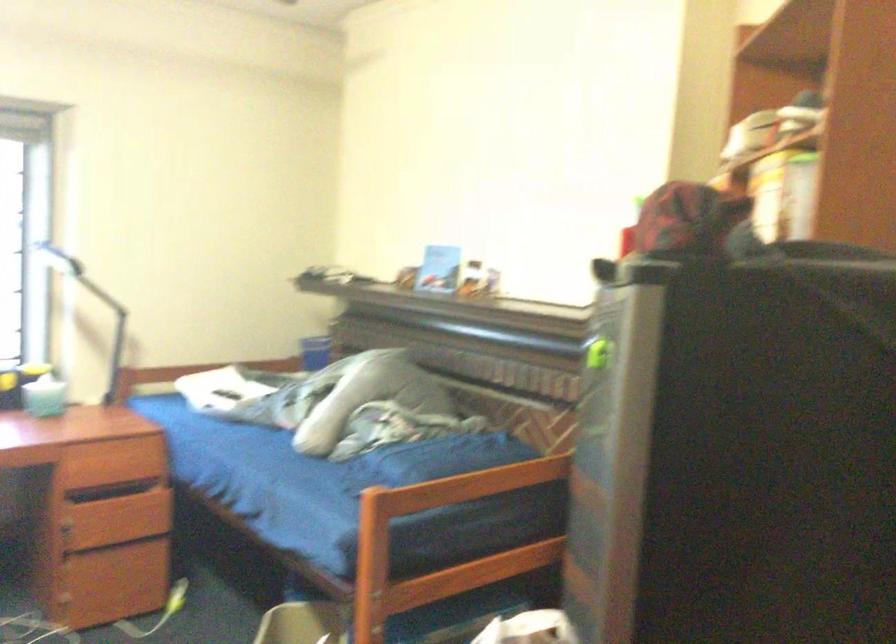
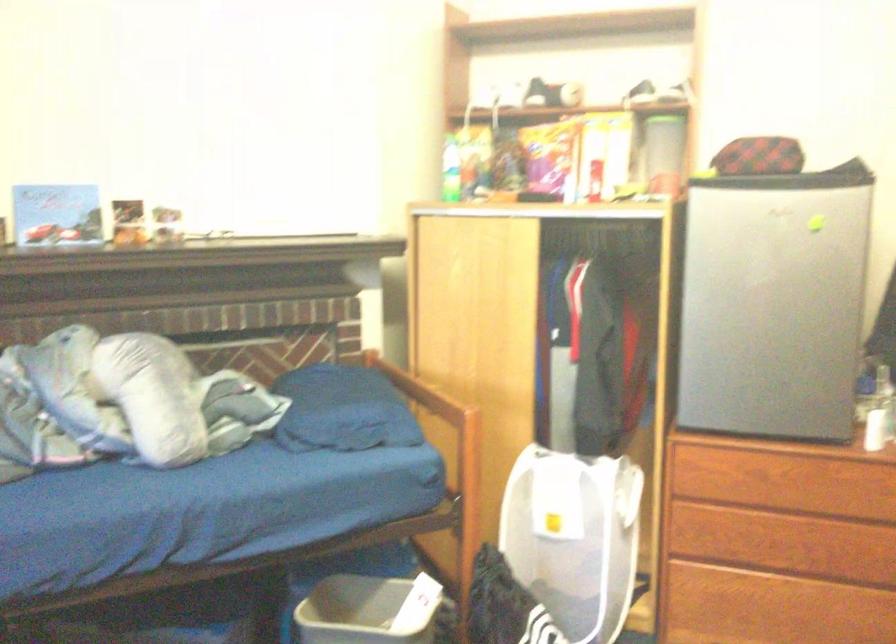
Where in the second image is the point corresponding to point (435, 267) from the first image?

(56, 214)